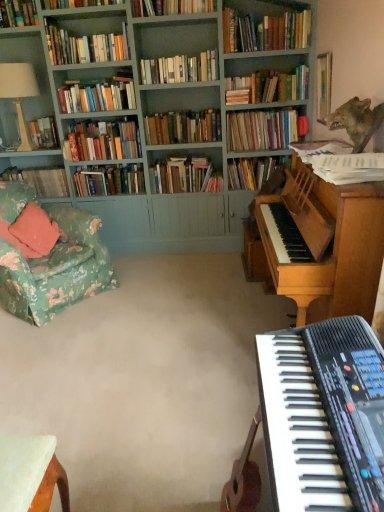
Question: Which direction should I rotate to face hardcover books at upper center, marked as the 7th book in a back-to-front arrangement, — up or down?

Choices:
 (A) up
 (B) down

Answer: (A)

Question: Considering the relative positions of teal painted wood bookcase at upper left and hardcover books at upper center, which is the 13th book from back to front, in the image provided, is teal painted wood bookcase at upper left behind hardcover books at upper center, which is the 13th book from back to front,?

Choices:
 (A) yes
 (B) no

Answer: (B)

Question: Considering the relative sizes of teal painted wood bookcase at upper left and hardcover books at upper center, which is the 13th book from back to front, in the image provided, is teal painted wood bookcase at upper left bigger than hardcover books at upper center, which is the 13th book from back to front,?

Choices:
 (A) no
 (B) yes

Answer: (B)

Question: From a real-world perspective, does teal painted wood bookcase at upper left stand above hardcover books at upper center, which is the second book in front-to-back order?

Choices:
 (A) no
 (B) yes

Answer: (A)

Question: Considering the relative sizes of teal painted wood bookcase at upper left and hardcover books at upper center, which is the 13th book from back to front, in the image provided, is teal painted wood bookcase at upper left smaller than hardcover books at upper center, which is the 13th book from back to front,?

Choices:
 (A) no
 (B) yes

Answer: (A)

Question: Would you say teal painted wood bookcase at upper left is outside hardcover books at upper center, which is the second book in front-to-back order?

Choices:
 (A) no
 (B) yes

Answer: (B)

Question: From the image's perspective, does teal painted wood bookcase at upper left appear lower than hardcover books at upper center, which is the 13th book from back to front?

Choices:
 (A) no
 (B) yes

Answer: (B)

Question: Considering the relative sizes of hardcover books at upper center, which is the 13th book from back to front, and white ceramic lamp at upper left in the image provided, is hardcover books at upper center, which is the 13th book from back to front, wider than white ceramic lamp at upper left?

Choices:
 (A) no
 (B) yes

Answer: (B)

Question: Are hardcover books at upper center, which is the second book in front-to-back order, and white ceramic lamp at upper left located far from each other?

Choices:
 (A) no
 (B) yes

Answer: (B)

Question: Is hardcover books at upper center, which is the 13th book from back to front, oriented away from white ceramic lamp at upper left?

Choices:
 (A) no
 (B) yes

Answer: (A)

Question: Is the depth of hardcover books at upper center, which is the second book in front-to-back order, less than that of white ceramic lamp at upper left?

Choices:
 (A) yes
 (B) no

Answer: (A)

Question: Considering the relative sizes of hardcover books at upper center, which is the second book in front-to-back order, and white ceramic lamp at upper left in the image provided, is hardcover books at upper center, which is the second book in front-to-back order, shorter than white ceramic lamp at upper left?

Choices:
 (A) yes
 (B) no

Answer: (A)

Question: Is the position of hardcover books at upper center, which is the 13th book from back to front, more distant than that of white ceramic lamp at upper left?

Choices:
 (A) no
 (B) yes

Answer: (A)

Question: Considering the relative sizes of shiny metallic wolf at upper right and teal painted wood bookcase at upper left in the image provided, is shiny metallic wolf at upper right shorter than teal painted wood bookcase at upper left?

Choices:
 (A) no
 (B) yes

Answer: (B)